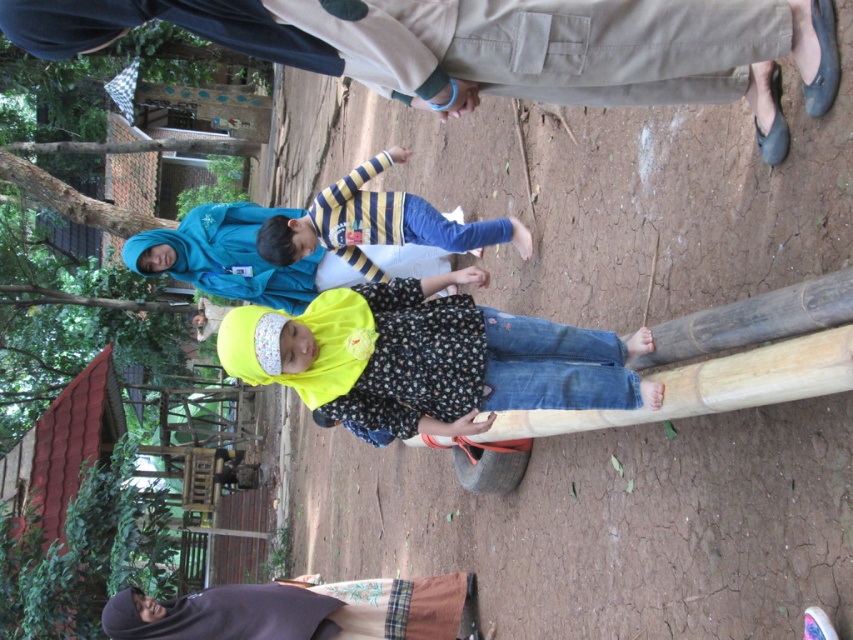
You are a photographer planning to take a photo of the scene. You need to ensure that both the floral fabric dress at center and the dark purple fabric at lower left are clearly visible. Given their sizes, which object should you focus on first to ensure it is in sharp focus?

The floral fabric dress at center is larger than the dark purple fabric at lower left, so you should focus on the floral fabric dress at center first to ensure it is in sharp focus.

You are a photographer trying to capture a clear photo of both the dark purple fabric at lower left and the striped fabric shirt at center. Since you want to focus on the lower parts of both objects, which one should you adjust your camera lens to focus on first?

The dark purple fabric at lower left is shorter than the striped fabric shirt at center, so you should focus on the dark purple fabric at lower left first because it is closer to the ground and thus lower in position.

You are a photographer taking a picture of the scene. You want to focus on the striped fabric shirt at center and dark purple fabric at lower left. Which object should you adjust your camera focus on first to ensure both are in focus?

The dark purple fabric at lower left is closer to the viewer than the striped fabric shirt at center. To ensure both are in focus, you should focus on the dark purple fabric at lower left first, as it is closer, and the striped fabric shirt at center will naturally fall into focus behind it.